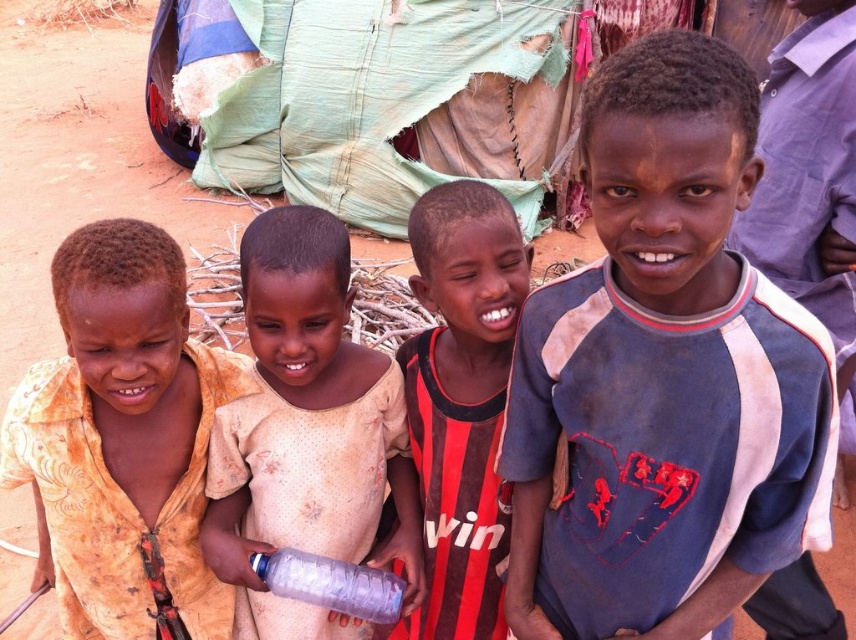
You are a photographer trying to capture a group photo of the children. You notice two shirts in the center of the group. Which child wearing the light brown fabric shirt at center needs to stand on a small stool to ensure their head is at the same level as the child in the red and black striped shirt at center?

The light brown fabric shirt at center has a lesser height compared to the red and black striped shirt at center, so the child wearing the light brown fabric shirt at center should stand on a small stool to reach the same head level as the child in the red and black striped shirt at center.

You are a photographer trying to capture a group photo of the blue cotton shirt at center and the light brown fabric shirt at center. Since you want both shirts to appear equally sized in the photo, which child should you move closer to the camera?

You should move the light brown fabric shirt at center closer to the camera because the blue cotton shirt at center is wider than the light brown fabric shirt at center. By moving the smaller shirt forward, their sizes in the photo will appear more balanced.